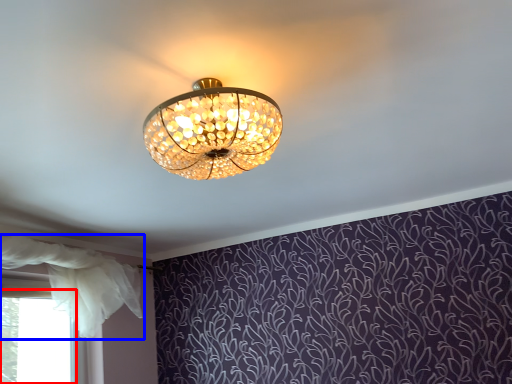
Question: Which object is closer to the camera taking this photo, bay window (highlighted by a red box) or curtain (highlighted by a blue box)?

Choices:
 (A) bay window
 (B) curtain

Answer: (B)